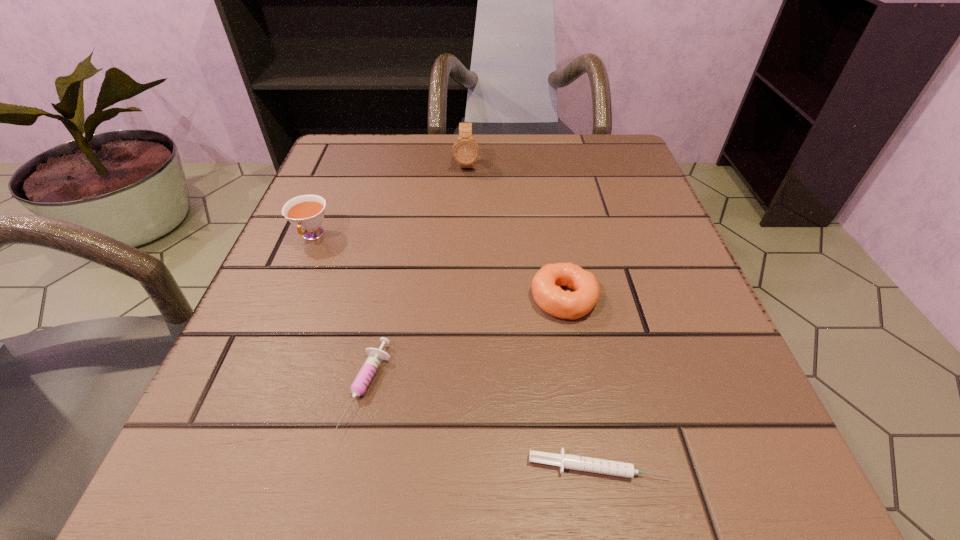
Where is `object that is at the near right corner`? The height and width of the screenshot is (540, 960). object that is at the near right corner is located at coordinates pyautogui.click(x=601, y=466).

Find the location of a particular element. vacant space at the far edge of the desktop is located at coordinates (518, 134).

The height and width of the screenshot is (540, 960). Identify the location of vacant space at the left edge. (333, 244).

Locate an element on the screen. The image size is (960, 540). blank space at the right edge of the desktop is located at coordinates (608, 259).

What are the coordinates of `free point at the far left corner` in the screenshot? It's located at (396, 168).

This screenshot has width=960, height=540. In the image, there is a desktop. Find the location of `vacant space at the near left corner`. vacant space at the near left corner is located at coordinates (237, 481).

Image resolution: width=960 pixels, height=540 pixels. In the image, there is a desktop. In order to click on free region at the near right corner in this screenshot , I will do `click(689, 508)`.

Locate an element on the screen. free area in between the fourth nearest object and the farthest object is located at coordinates (390, 200).

The height and width of the screenshot is (540, 960). Identify the location of vacant point located between the left syringe and the tallest object. (418, 276).

Locate an element on the screen. blank region between the second nearest object and the nearer syringe is located at coordinates pyautogui.click(x=483, y=427).